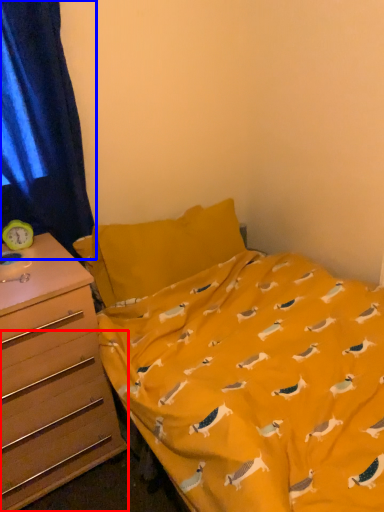
Question: Which object appears farthest to the camera in this image, drawer (highlighted by a red box) or curtain (highlighted by a blue box)?

Choices:
 (A) drawer
 (B) curtain

Answer: (B)